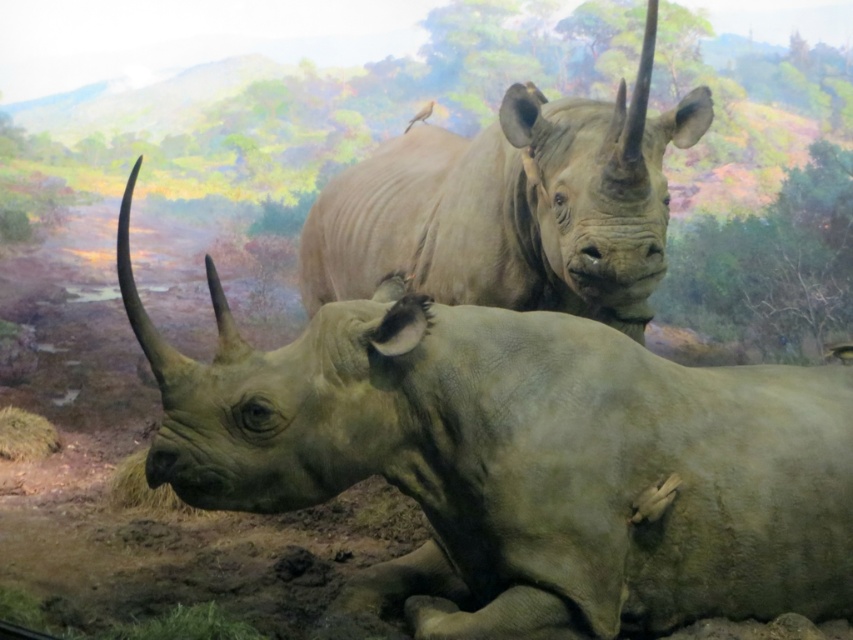
You are observing a diorama of two rhinoceroses. You notice two points marked in the image. One is at coordinate point (496, 628) and the other at point (393, 224). Which point is nearer to you as you look at the image?

Point (496, 628) is closer to the camera than point (393, 224), so the point at (496, 628) is nearer to you.